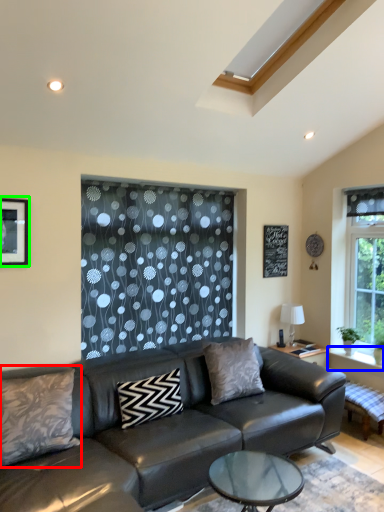
Question: Which is farther away from pillow (highlighted by a red box)? window sill (highlighted by a blue box) or picture frame (highlighted by a green box)?

Choices:
 (A) window sill
 (B) picture frame

Answer: (A)